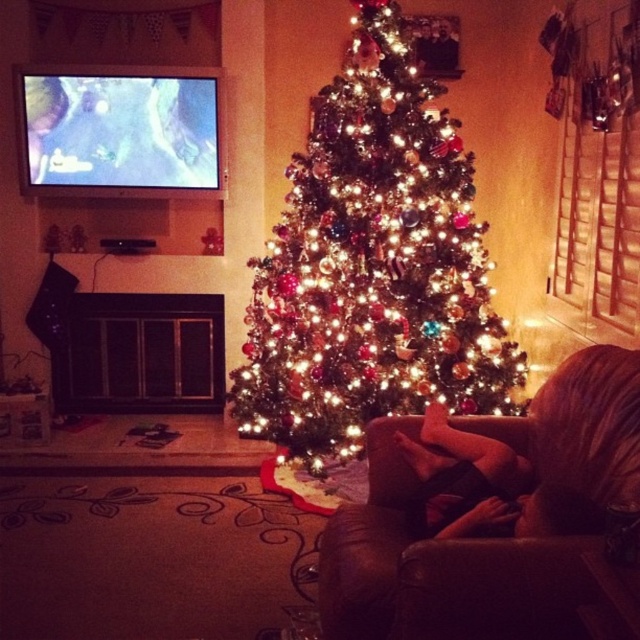
You are planning to place a rectangular coffee table that is 1.2 meters wide between the brown leather couch at center and the black leather pants at lower center. Based on the space available, will the coffee table fit comfortably without touching either piece of furniture?

The brown leather couch at center might be wider than black leather pants at lower center, so the distance between them is uncertain. Without knowing the exact spacing, it is difficult to determine if the 1.2 meter coffee table will fit comfortably.

You are a guest at a holiday party and want to sit down. You see a brown leather couch at center and black leather pants at lower center. Which one is closer to you?

The brown leather couch at center is closer to you because it is in front of the black leather pants at lower center.